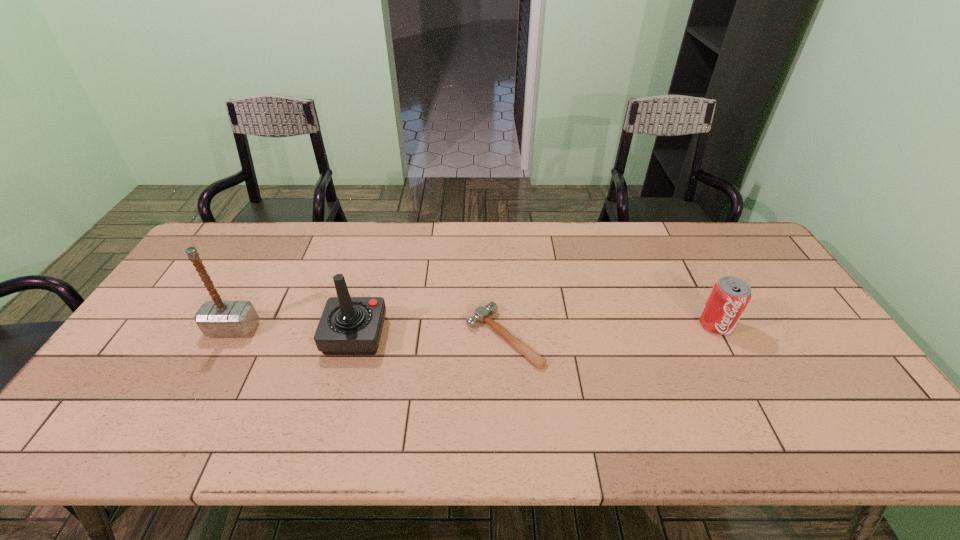
In order to click on the leftmost object in this screenshot , I will do `click(217, 318)`.

Identify the location of the tallest object. The image size is (960, 540). (217, 318).

The image size is (960, 540). I want to click on the third shortest object, so click(348, 325).

Identify the location of joystick. This screenshot has height=540, width=960. (348, 325).

This screenshot has width=960, height=540. In order to click on soda can in this screenshot , I will do pos(729,296).

Where is `the third tallest object`? The image size is (960, 540). the third tallest object is located at coordinates (729, 296).

Locate an element on the screen. The width and height of the screenshot is (960, 540). the shortest object is located at coordinates (481, 314).

This screenshot has width=960, height=540. What are the coordinates of `the right hammer` in the screenshot? It's located at (481, 314).

This screenshot has height=540, width=960. I want to click on vacant space located on the striking surface of the tallest object, so click(x=174, y=436).

Locate an element on the screen. The height and width of the screenshot is (540, 960). free space located on the front-facing side of the second tallest object is located at coordinates (443, 335).